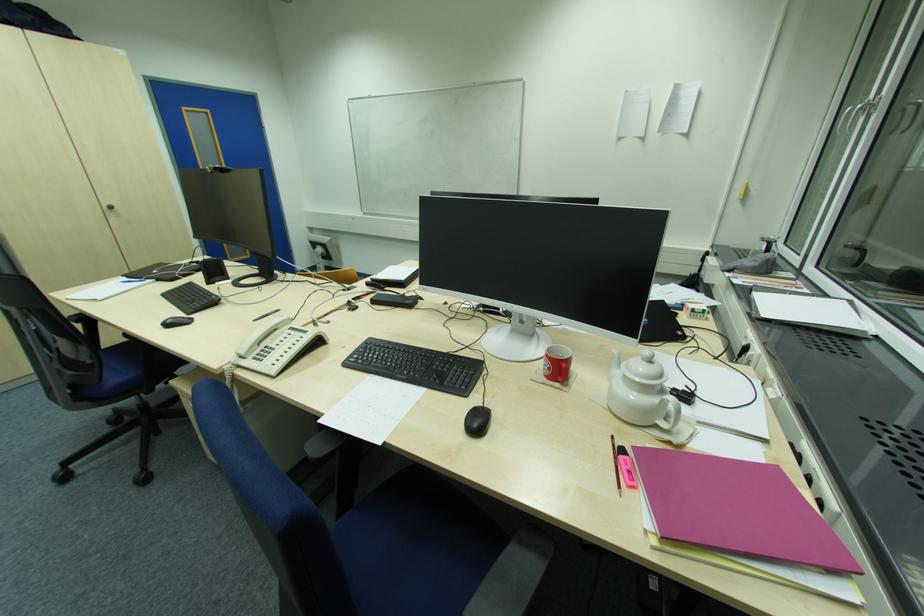
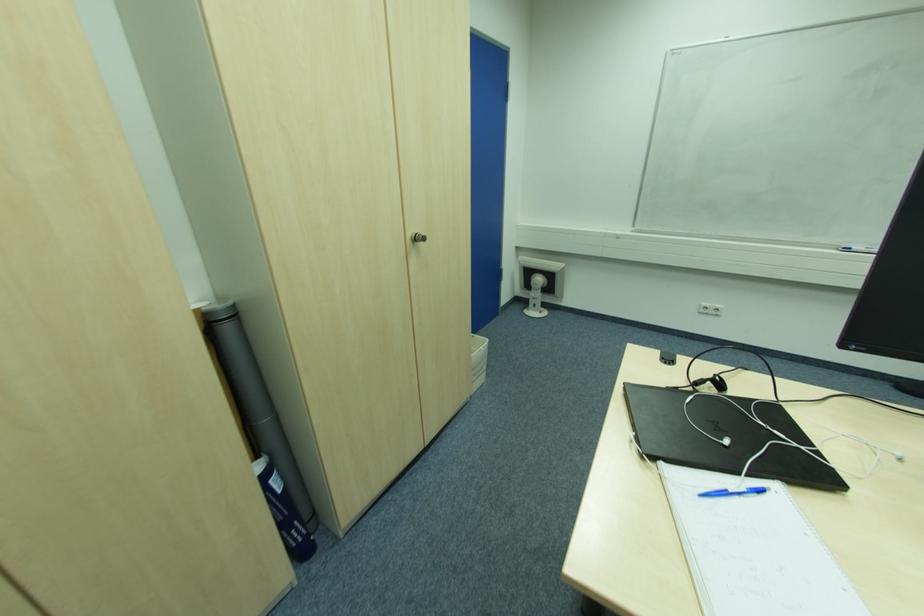
Find the pixel in the second image that matches (136,283) in the first image.

(727, 493)